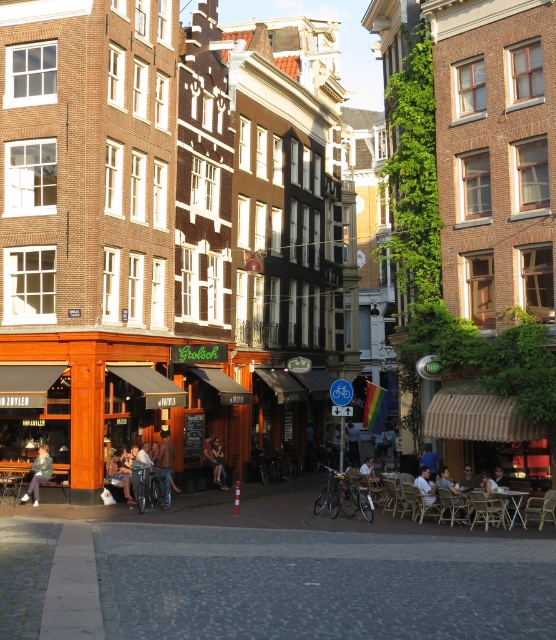
Question: Which point is closer to the camera taking this photo?

Choices:
 (A) (428, 454)
 (B) (7, 486)
 (C) (121, 371)

Answer: (B)

Question: Which is farther from the blue denim shirt at lower right?

Choices:
 (A) denim jacket at lower left
 (B) leather jacket at center
 (C) dark blue fabric jacket at center
 (D) metallic silver table at center

Answer: (A)

Question: Considering the real-world distances, which object is farthest from the metallic silver table at center?

Choices:
 (A) denim jacket at lower left
 (B) blue denim shirt at lower right

Answer: (A)

Question: Can you confirm if wooden chair at center is bigger than metallic silver table at center?

Choices:
 (A) yes
 (B) no

Answer: (A)

Question: Considering the relative positions of leather jacket at center and blue denim shirt at lower right in the image provided, where is leather jacket at center located with respect to blue denim shirt at lower right?

Choices:
 (A) below
 (B) above

Answer: (A)

Question: Is matte wooden cafe at lower left closer to the viewer compared to dark blue fabric jacket at center?

Choices:
 (A) yes
 (B) no

Answer: (A)